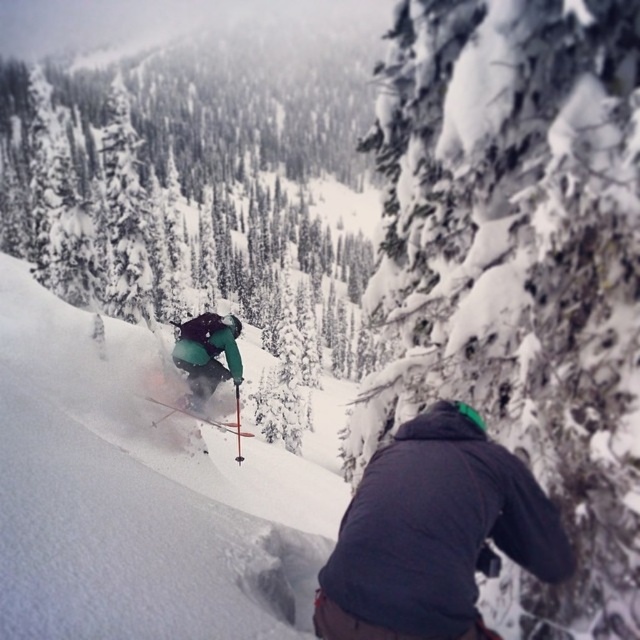
In the scene shown: You are planning to place a 5.0 meter long safety rope between the snowy bark tree at center and the shiny metallic ski at center. Based on the scene description, will the rope be long enough to stretch between them?

The distance between the snowy bark tree at center and the shiny metallic ski at center is 4.90 meters. Since the rope is 5.0 meters long, it will be long enough to stretch between them with a small amount of extra length remaining.

You are a photographer trying to capture the skier on the powder snow ski slope at center and the shiny metallic ski at center. Which object should you focus on first if you want to ensure both are in sharp focus?

The powder snow ski slope at center is in front of the shiny metallic ski at center, so you should focus on the powder snow ski slope at center first to ensure both are in sharp focus.

You are a photographer trying to capture the skier in the snow. You need to decide where to place your camera to ensure both the powder snow ski slope at center and the shiny metallic ski at center are visible. Based on their positions, which object should be in the foreground?

The shiny metallic ski at center should be in the foreground because the powder snow ski slope at center is above it, meaning the ski is closer to the camera.